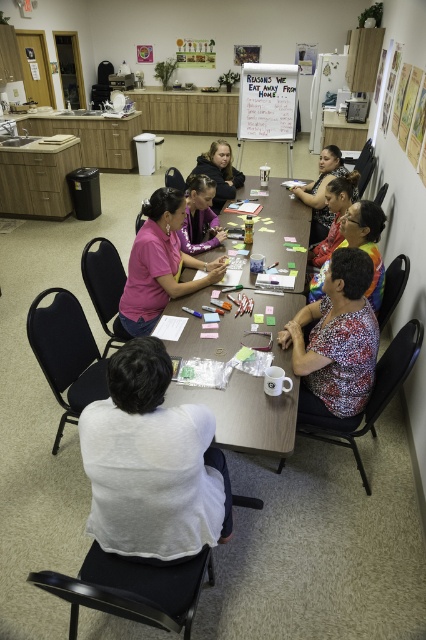
You are standing at the entrance of the community center and want to locate the wooden table at center. What are the coordinates where you can find it?

The wooden table at center is located at coordinates point (253,392).

Where is the matte pink shirt at center located in the image?

The matte pink shirt at center is located at point (158,266) in the image.